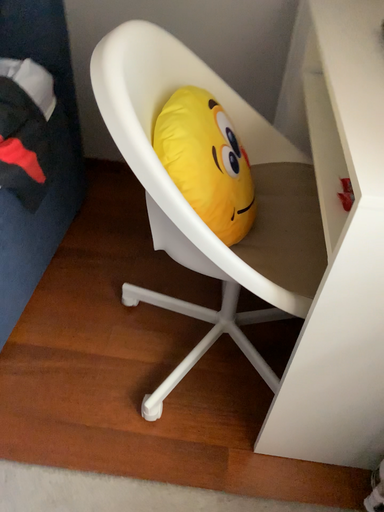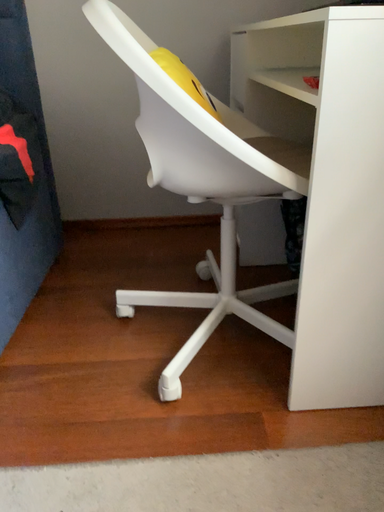
Question: Which way did the camera rotate in the video?

Choices:
 (A) rotated upward
 (B) rotated downward

Answer: (A)